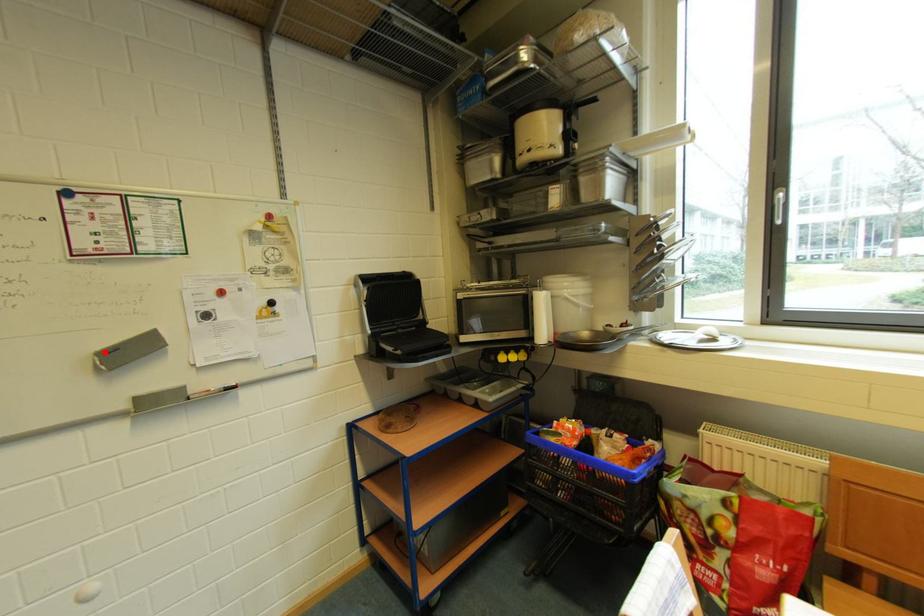
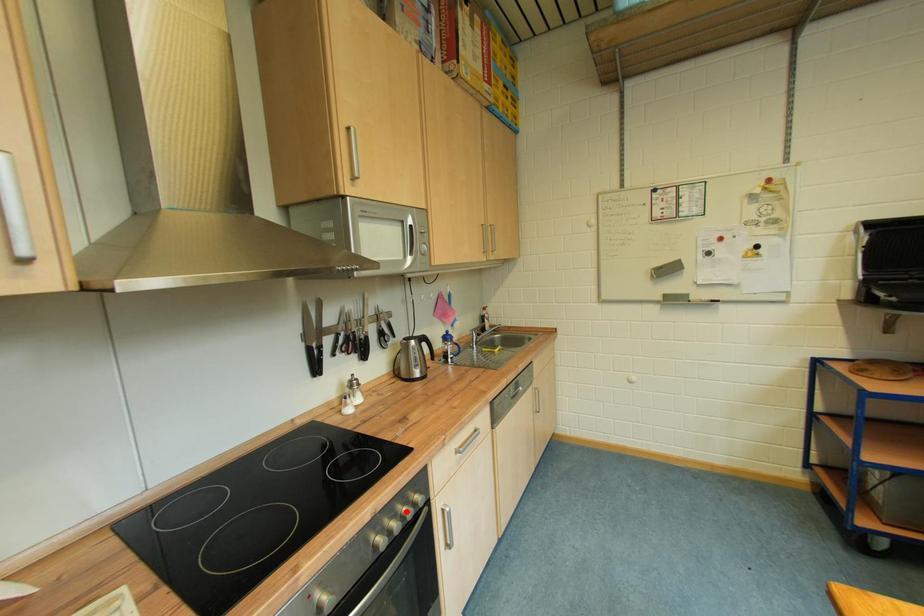
I am providing you with two images of the same scene from different viewpoints. A red point is marked on the first image and another point is marked on the second image. Is the red point in image1 aligned with the point shown in image2?

No